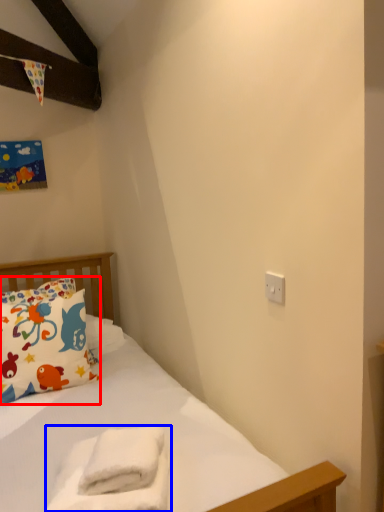
Question: Among these objects, which one is farthest to the camera, pillow (highlighted by a red box) or material (highlighted by a blue box)?

Choices:
 (A) pillow
 (B) material

Answer: (A)